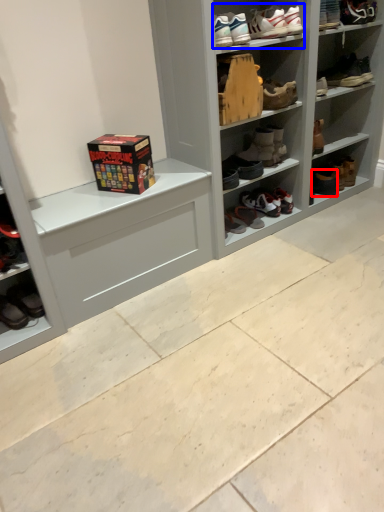
Question: Which object is closer to the camera taking this photo, footwear (highlighted by a red box) or footwear (highlighted by a blue box)?

Choices:
 (A) footwear
 (B) footwear

Answer: (B)